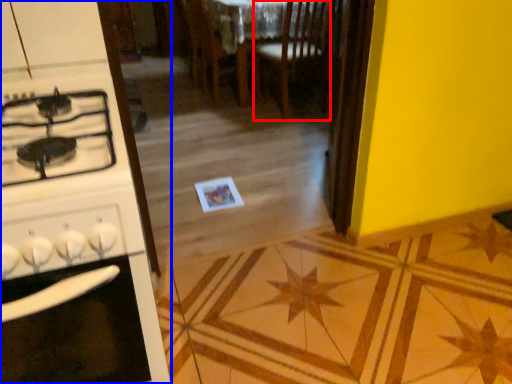
Question: Among these objects, which one is nearest to the camera, chair (highlighted by a red box) or kitchen appliance (highlighted by a blue box)?

Choices:
 (A) chair
 (B) kitchen appliance

Answer: (B)